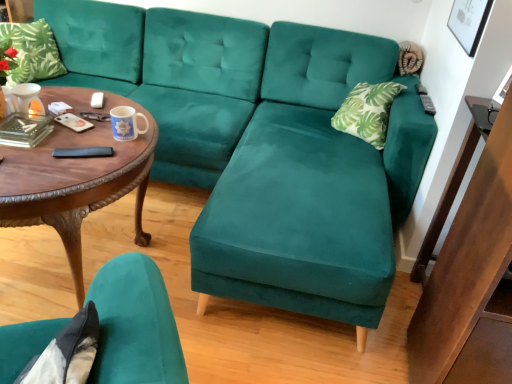
Question: Is green leafy fabric pillow at upper left at the right side of woodencoffee table at left?

Choices:
 (A) yes
 (B) no

Answer: (B)

Question: Is green leafy fabric pillow at upper left positioned behind woodencoffee table at left?

Choices:
 (A) no
 (B) yes

Answer: (B)

Question: Is green leafy fabric pillow at upper left to the left of woodencoffee table at left from the viewer's perspective?

Choices:
 (A) no
 (B) yes

Answer: (B)

Question: Is green leafy fabric pillow at upper left looking in the opposite direction of woodencoffee table at left?

Choices:
 (A) no
 (B) yes

Answer: (A)

Question: Is green leafy fabric pillow at upper left completely or partially outside of woodencoffee table at left?

Choices:
 (A) no
 (B) yes

Answer: (B)

Question: In the image, is wooden side table at right on the left side or the right side of woodencoffee table at left?

Choices:
 (A) right
 (B) left

Answer: (A)

Question: Is point (466, 142) closer or farther from the camera than point (45, 87)?

Choices:
 (A) closer
 (B) farther

Answer: (A)

Question: From a real-world perspective, is wooden side table at right above or below woodencoffee table at left?

Choices:
 (A) below
 (B) above

Answer: (B)

Question: Relative to woodencoffee table at left, is wooden side table at right in front or behind?

Choices:
 (A) behind
 (B) front

Answer: (A)

Question: In terms of size, does green leafy fabric pillow at upper left appear bigger or smaller than velvet teal chair at lower left?

Choices:
 (A) small
 (B) big

Answer: (A)

Question: Considering the positions of green leafy fabric pillow at upper left and velvet teal chair at lower left in the image, is green leafy fabric pillow at upper left taller or shorter than velvet teal chair at lower left?

Choices:
 (A) tall
 (B) short

Answer: (B)

Question: Is point (44, 72) closer or farther from the camera than point (141, 345)?

Choices:
 (A) closer
 (B) farther

Answer: (B)

Question: Based on their positions, is green leafy fabric pillow at upper left located to the left or right of velvet teal chair at lower left?

Choices:
 (A) right
 (B) left

Answer: (B)

Question: Is velvet teal chair at lower left wider or thinner than green leafy fabric pillow at upper left?

Choices:
 (A) wide
 (B) thin

Answer: (A)

Question: Considering the positions of velvet teal chair at lower left and green leafy fabric pillow at upper left in the image, is velvet teal chair at lower left taller or shorter than green leafy fabric pillow at upper left?

Choices:
 (A) short
 (B) tall

Answer: (B)